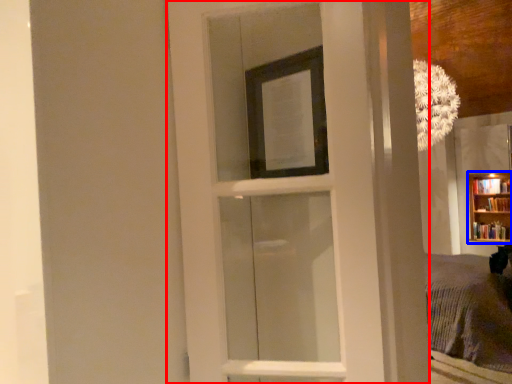
Question: Which object appears closest to the camera in this image, door (highlighted by a red box) or bookcase (highlighted by a blue box)?

Choices:
 (A) door
 (B) bookcase

Answer: (A)